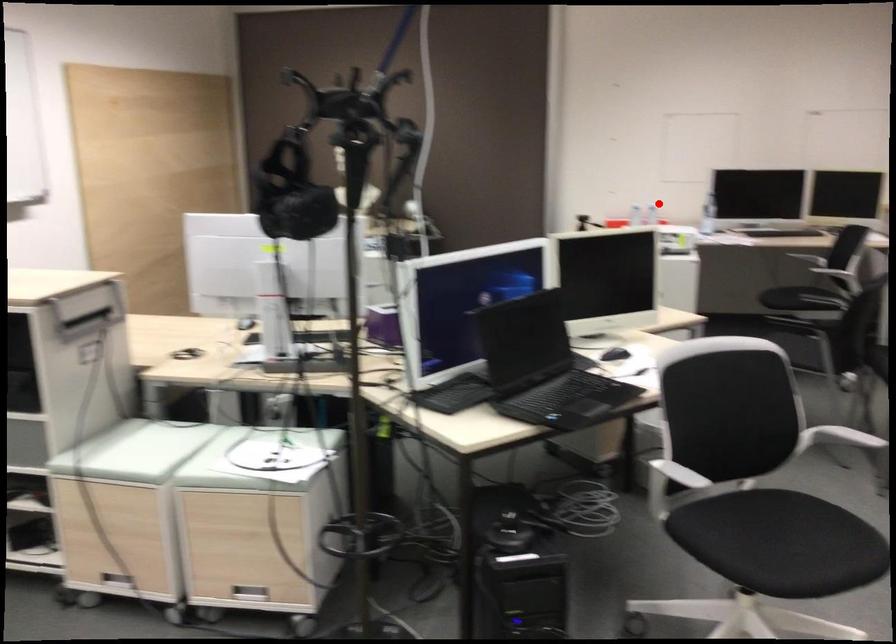
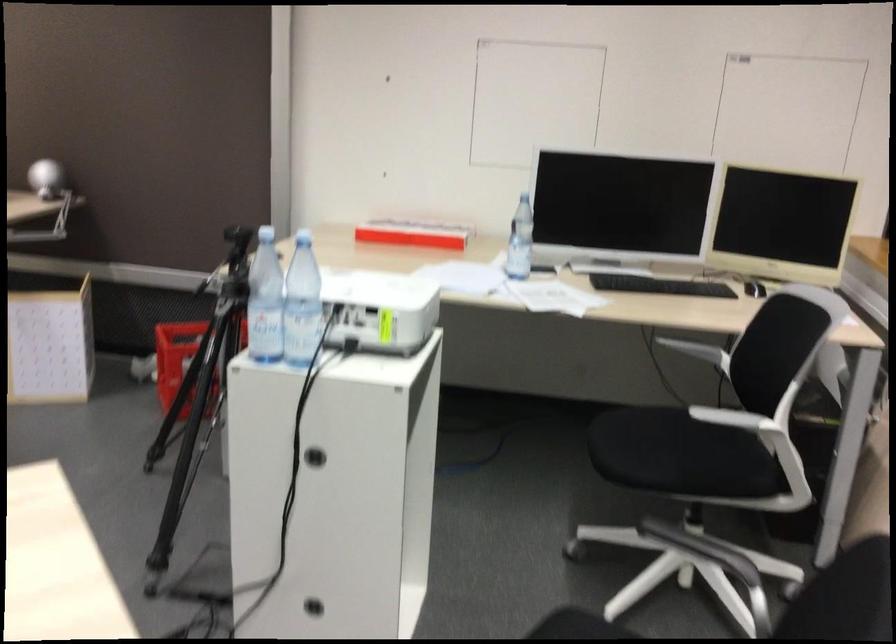
Question: I am providing you with two images of the same scene from different viewpoints. Image1 has a red point marked. In image2, the corresponding 3D location appears at what relative position? Reply with the corresponding letter.

Choices:
 (A) Closer
 (B) Farther

Answer: (A)